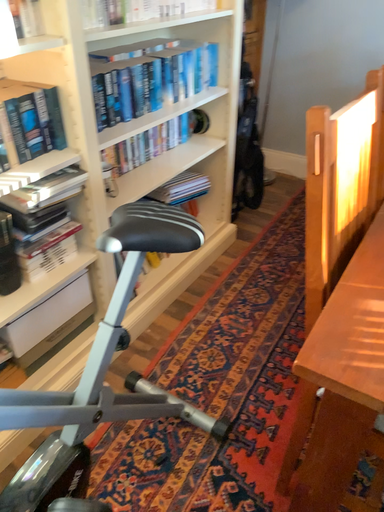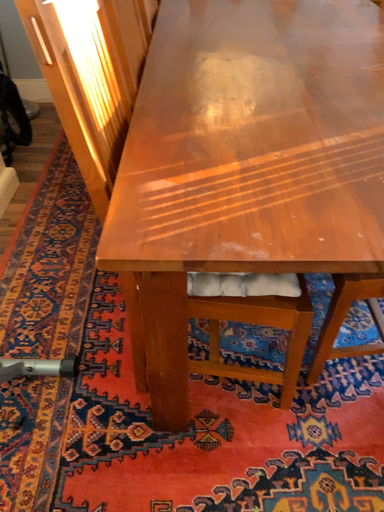
Question: How did the camera likely rotate when shooting the video?

Choices:
 (A) rotated left
 (B) rotated right

Answer: (B)